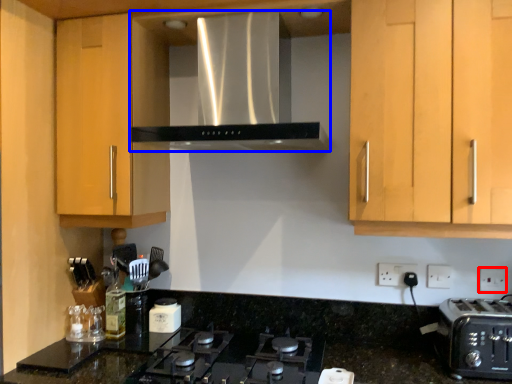
Question: Which point is closer to the camera, electric outlet (highlighted by a red box) or home appliance (highlighted by a blue box)?

Choices:
 (A) electric outlet
 (B) home appliance

Answer: (B)